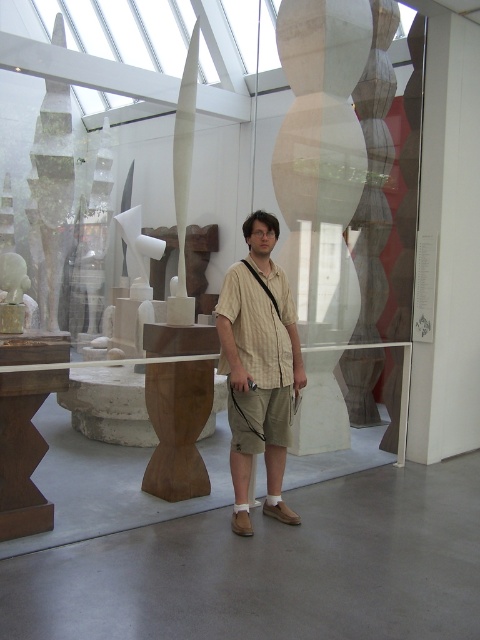
Question: Which point is closer to the camera taking this photo?

Choices:
 (A) (244, 486)
 (B) (260, 305)

Answer: (B)

Question: Considering the relative positions of light beige striped shirt at center and beige striped shirt at center in the image provided, where is light beige striped shirt at center located with respect to beige striped shirt at center?

Choices:
 (A) below
 (B) above

Answer: (A)

Question: Which point is farther to the camera?

Choices:
 (A) (252, 321)
 (B) (244, 413)

Answer: (B)

Question: Does light beige striped shirt at center have a smaller size compared to beige striped shirt at center?

Choices:
 (A) no
 (B) yes

Answer: (A)

Question: Can you confirm if light beige striped shirt at center is bigger than beige striped shirt at center?

Choices:
 (A) no
 (B) yes

Answer: (B)